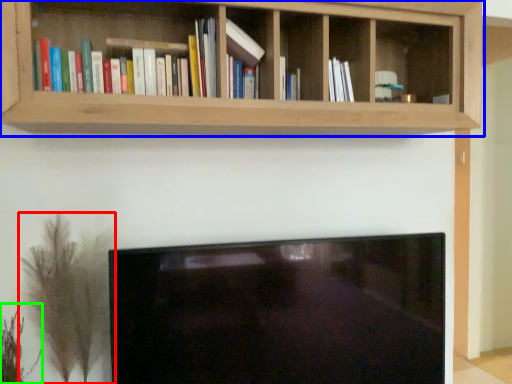
Question: Which object is positioned closest to plant (highlighted by a red box)? Select from shelf (highlighted by a blue box) and plant (highlighted by a green box).

Choices:
 (A) shelf
 (B) plant

Answer: (B)